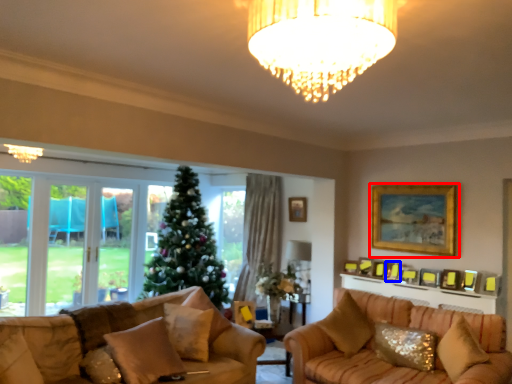
Question: Among these objects, which one is nearest to the camera, picture frame (highlighted by a red box) or picture frame (highlighted by a blue box)?

Choices:
 (A) picture frame
 (B) picture frame

Answer: (A)